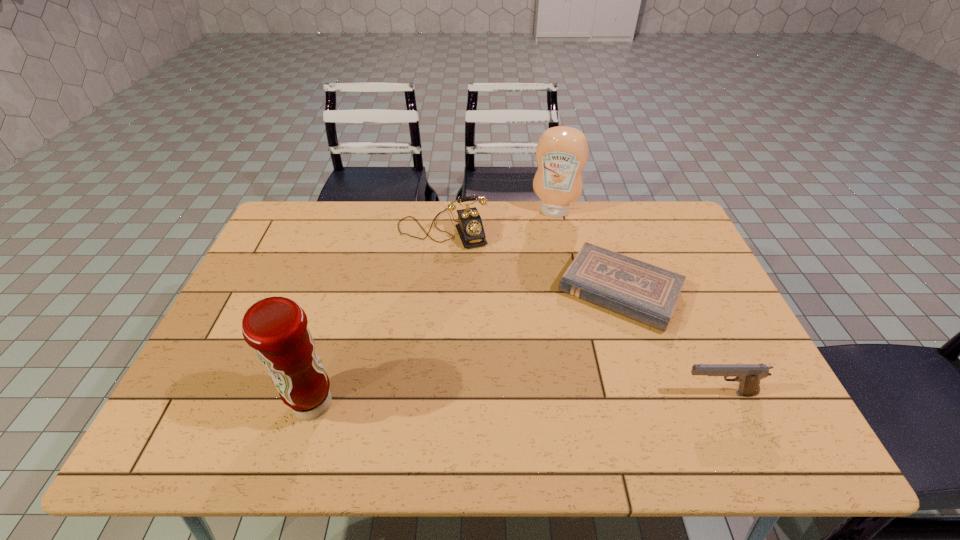
Find the location of a particular element. This screenshot has height=540, width=960. the leftmost object is located at coordinates (276, 327).

The image size is (960, 540). Find the location of `the nearer condiment`. the nearer condiment is located at coordinates (276, 327).

At what (x,y) coordinates should I click in order to perform the action: click on the fourth tallest object. Please return your answer as a coordinate pair (x, y). The height and width of the screenshot is (540, 960). Looking at the image, I should click on (748, 375).

The image size is (960, 540). I want to click on the farther condiment, so click(x=562, y=152).

The width and height of the screenshot is (960, 540). Find the location of `the second object from left to right`. the second object from left to right is located at coordinates (470, 228).

Where is `Bible`? Bible is located at coordinates (638, 290).

Where is `the shortest object`? This screenshot has width=960, height=540. the shortest object is located at coordinates (638, 290).

I want to click on vacant space located 0.350m on the back of the nearer condiment, so click(351, 277).

Image resolution: width=960 pixels, height=540 pixels. In order to click on vacant space located at the barrel of the fourth tallest object in this screenshot , I will do `click(637, 394)`.

Locate an element on the screen. vacant point located at the barrel of the fourth tallest object is located at coordinates (607, 394).